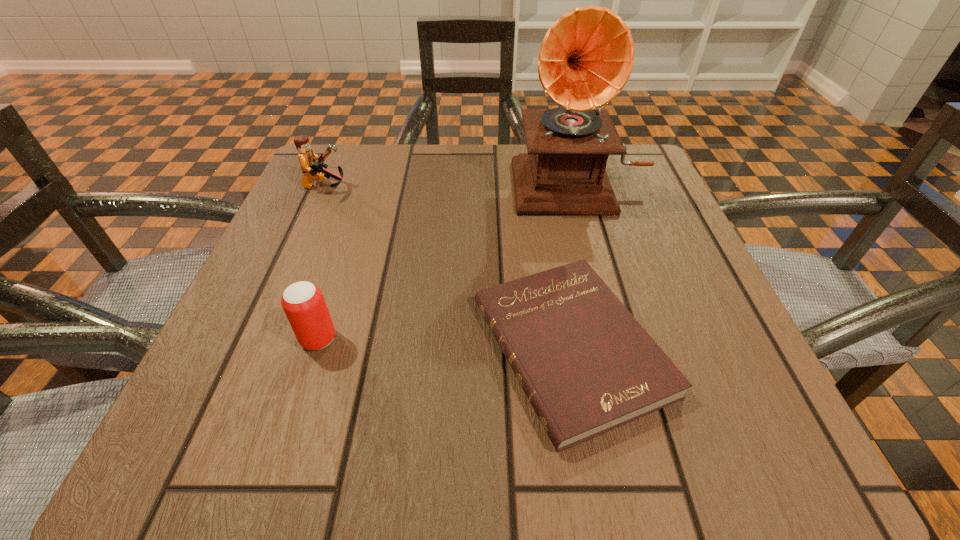
The image size is (960, 540). Identify the location of phonograph record. [x=586, y=58].

The image size is (960, 540). What are the coordinates of `the leftmost object` in the screenshot? It's located at (312, 169).

At what (x,y) coordinates should I click in order to perform the action: click on beer can. Please return your answer as a coordinate pair (x, y). Looking at the image, I should click on (303, 303).

Find the location of a particular element. The width and height of the screenshot is (960, 540). the shortest object is located at coordinates (587, 366).

You are a GUI agent. You are given a task and a screenshot of the screen. Output one action in this format:
    pyautogui.click(x=<x>, y=<y>)
    Task: Click on the vacant area situated on the horn of the tallest object
    The height and width of the screenshot is (540, 960).
    Given the screenshot: What is the action you would take?
    pyautogui.click(x=632, y=366)

Locate an element on the screen. vacant space located 0.250m holding a crossbow in the hands of the leftmost object is located at coordinates (468, 187).

At what (x,y) coordinates should I click in order to perform the action: click on blank space located 0.220m on the back of the third object from right to left. Please return your answer as a coordinate pair (x, y). Looking at the image, I should click on (353, 232).

In order to click on free space located 0.390m on the back of the shortest object in this screenshot , I will do `click(537, 154)`.

Where is `phonograph record located in the far edge section of the desktop`? phonograph record located in the far edge section of the desktop is located at coordinates (586, 58).

At what (x,y) coordinates should I click in order to perform the action: click on Lego positioned at the far edge. Please return your answer as a coordinate pair (x, y). This screenshot has width=960, height=540. Looking at the image, I should click on (312, 169).